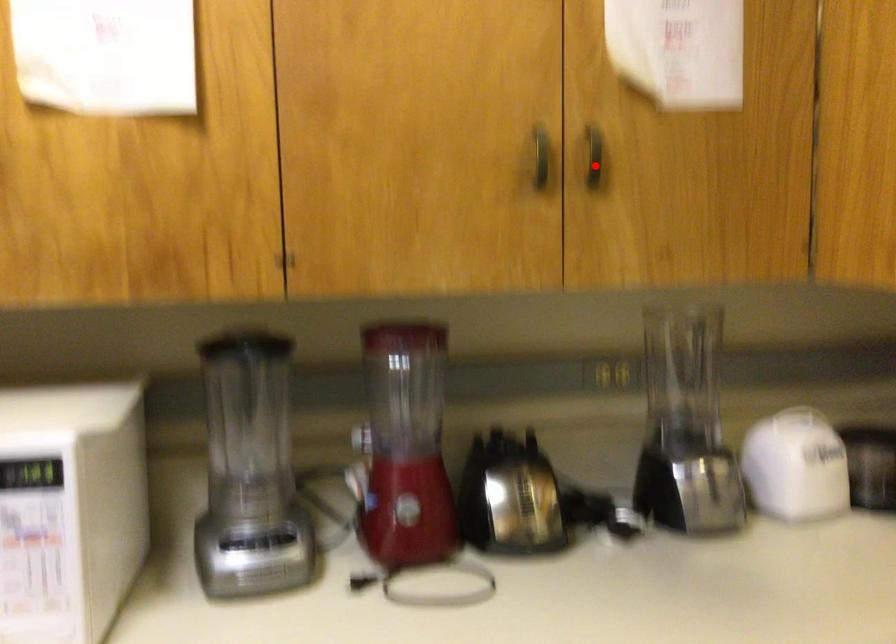
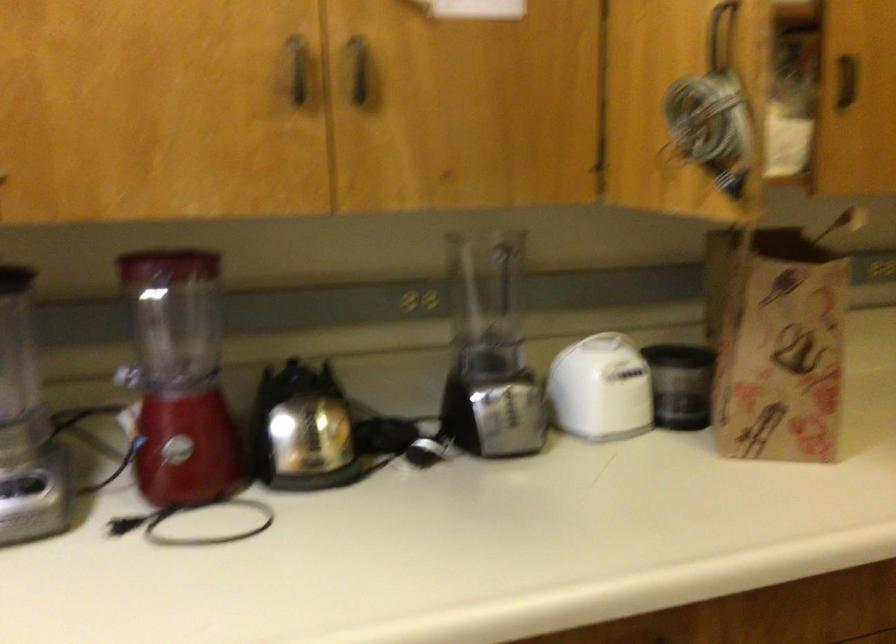
Question: I am providing you with two images of the same scene from different viewpoints. A red point is marked on the first image. At the location where the point appears in image 1, is it still visible in image 2?

Choices:
 (A) Yes
 (B) No

Answer: (A)